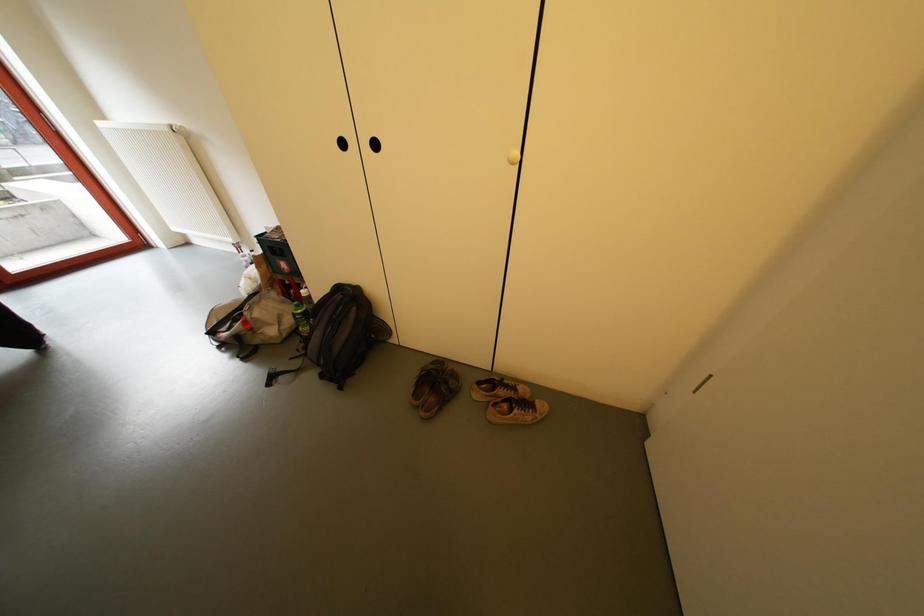
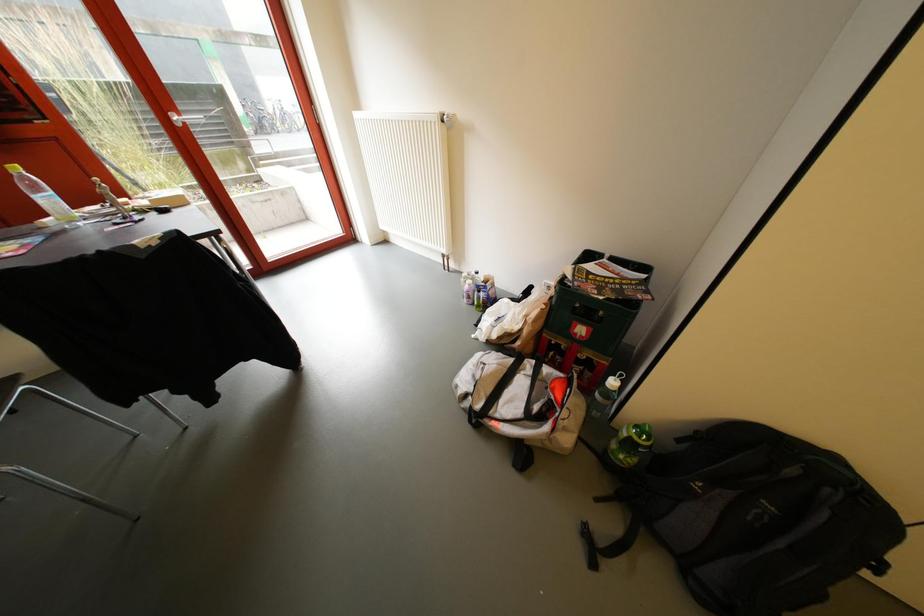
Question: Which direction would the cameraman need to move to produce the second image? Reply with the corresponding letter.

Choices:
 (A) Left
 (B) Right
 (C) Forward
 (D) Backward

Answer: (A)